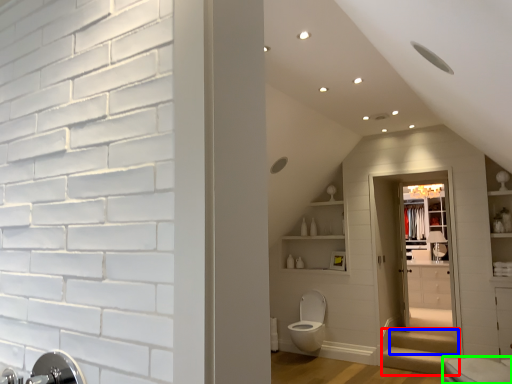
Question: Based on their relative distances, which object is farther from stairwell (highlighted by a red box)? Choose from stairwell (highlighted by a blue box) and toilet (highlighted by a green box).

Choices:
 (A) stairwell
 (B) toilet

Answer: (B)